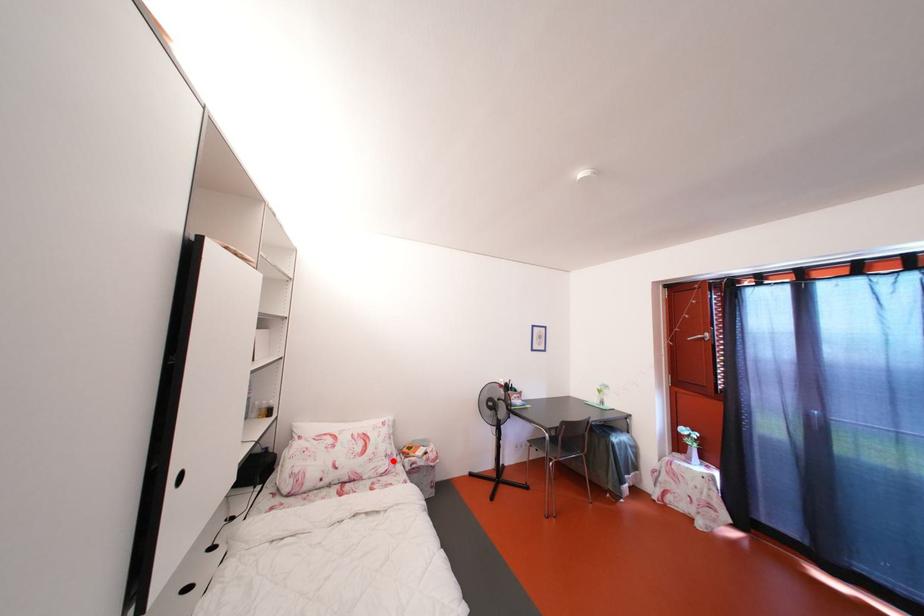
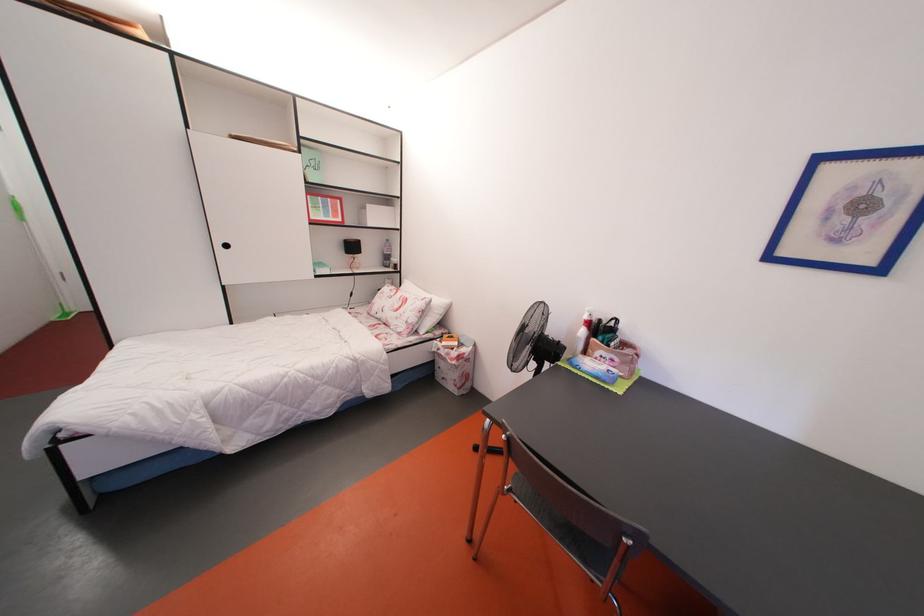
Locate, in the second image, the point that corresponds to the highlighted location in the first image.

(414, 328)